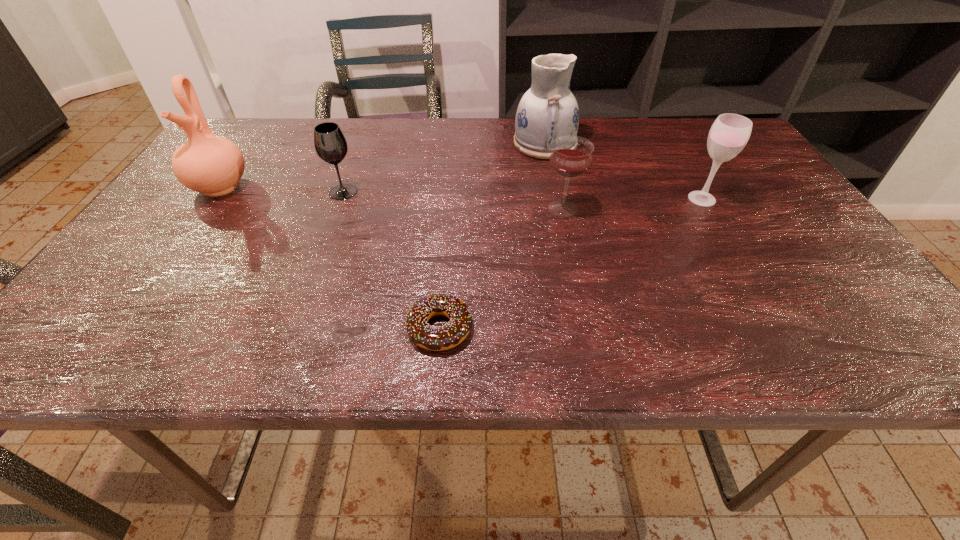
Find the location of a particular element. The image size is (960, 540). the left pottery is located at coordinates (212, 165).

The height and width of the screenshot is (540, 960). I want to click on the leftmost object, so click(x=212, y=165).

Where is `the right pottery`? The image size is (960, 540). the right pottery is located at coordinates (548, 110).

The height and width of the screenshot is (540, 960). What are the coordinates of `the farther pottery` in the screenshot? It's located at (548, 110).

Where is `the rightmost object`? This screenshot has height=540, width=960. the rightmost object is located at coordinates (729, 134).

Find the location of a particular element. This screenshot has width=960, height=540. the leftmost wineglass is located at coordinates (330, 144).

Where is `the second wineglass from left to right`? the second wineglass from left to right is located at coordinates (571, 156).

Find the location of a particular element. The width and height of the screenshot is (960, 540). the nearest object is located at coordinates (432, 338).

At what (x,y) coordinates should I click in order to perform the action: click on the shortest object. Please return your answer as a coordinate pair (x, y). The width and height of the screenshot is (960, 540). Looking at the image, I should click on (432, 338).

I want to click on free space located 0.120m on the spout of the nearer pottery, so click(183, 239).